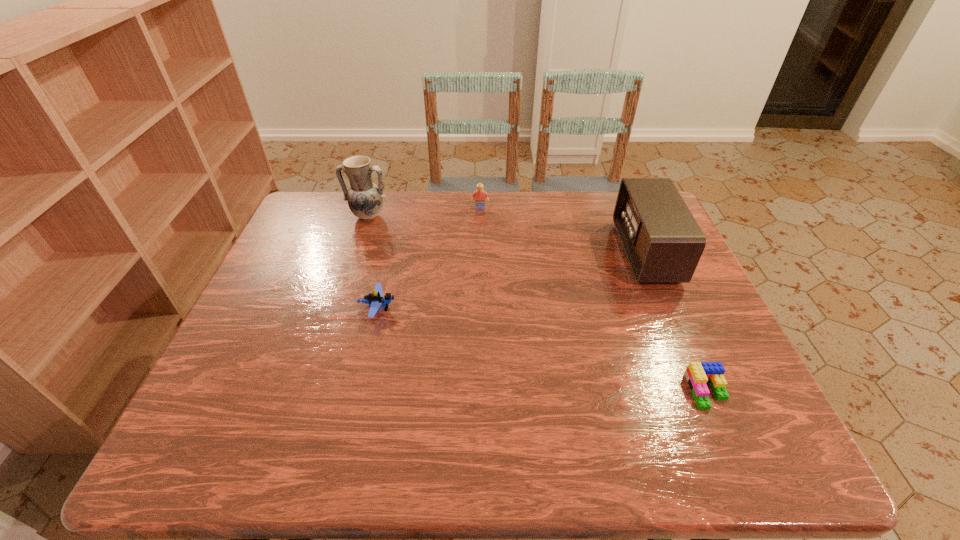
I want to click on the third closest Lego to the radio receiver, so click(375, 300).

Identify the location of Lego that can be found as the closest to the third shortest object. This screenshot has width=960, height=540. (375, 300).

The height and width of the screenshot is (540, 960). What are the coordinates of `free region that satisfies the following two spatial constraints: 1. on the front-facing side of the radio receiver; 2. on the back side of the shortest Lego` in the screenshot? It's located at (705, 391).

Where is `vacant region that satisfies the following two spatial constraints: 1. on either side of the shortest Lego; 2. on the right side of the tallest object`? The image size is (960, 540). vacant region that satisfies the following two spatial constraints: 1. on either side of the shortest Lego; 2. on the right side of the tallest object is located at coordinates (312, 391).

This screenshot has width=960, height=540. In order to click on free location that satisfies the following two spatial constraints: 1. on the back side of the shortest object; 2. on the front-facing side of the second shortest object in this screenshot , I will do `click(672, 309)`.

This screenshot has width=960, height=540. What are the coordinates of `free location that satisfies the following two spatial constraints: 1. on the front-facing side of the third shortest object; 2. on the front-facing side of the fourth farthest object` in the screenshot? It's located at (480, 309).

This screenshot has width=960, height=540. I want to click on free space in the image that satisfies the following two spatial constraints: 1. on either side of the tallest object; 2. on the right side of the rightmost Lego, so click(312, 391).

Where is `vacant space that satisfies the following two spatial constraints: 1. on the front-facing side of the second tallest object; 2. on the right side of the rightmost Lego`? This screenshot has height=540, width=960. vacant space that satisfies the following two spatial constraints: 1. on the front-facing side of the second tallest object; 2. on the right side of the rightmost Lego is located at coordinates (705, 391).